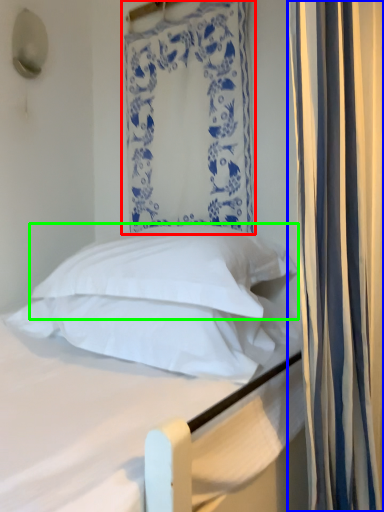
Question: Which object is the farthest from curtain (highlighted by a red box)? Choose among these: curtain (highlighted by a blue box) or pillow (highlighted by a green box).

Choices:
 (A) curtain
 (B) pillow

Answer: (A)